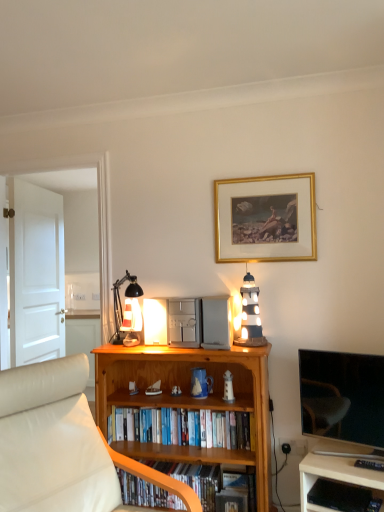
The image size is (384, 512). What do you see at coordinates (36, 274) in the screenshot?
I see `white painted wood door at left` at bounding box center [36, 274].

Consider the image. Measure the distance between wooden bookcase at center and camera.

wooden bookcase at center and camera are 6.71 feet apart.

What do you see at coordinates (342, 396) in the screenshot? The height and width of the screenshot is (512, 384). I see `flat screen tv at right` at bounding box center [342, 396].

What do you see at coordinates (250, 315) in the screenshot? I see `white striped wood lighthouse at upper right` at bounding box center [250, 315].

The height and width of the screenshot is (512, 384). In order to click on matte white glass table lamp at upper center in this screenshot , I will do pyautogui.click(x=120, y=301).

Considering the positions of point (72, 438) and point (12, 349), is point (72, 438) closer or farther from the camera than point (12, 349)?

Point (72, 438) appears to be closer to the viewer than point (12, 349).

From a real-world perspective, is white leather studio couch at lower left below white painted wood door at left?

Yes, from a real-world perspective, white leather studio couch at lower left is beneath white painted wood door at left.

Looking at this image, is white painted wood door at left at the back of white leather studio couch at lower left?

white leather studio couch at lower left is not turned away from white painted wood door at left.

You are a GUI agent. You are given a task and a screenshot of the screen. Output one action in this format:
    pyautogui.click(x=<x>, y=<y>)
    Task: Click on the door above the white leather studio couch at lower left (from a real-world perspective)
    The height and width of the screenshot is (512, 384).
    Given the screenshot: What is the action you would take?
    pyautogui.click(x=36, y=274)

In terms of size, does white painted wood door at left appear bigger or smaller than matte white glass table lamp at upper center?

Clearly, white painted wood door at left is larger in size than matte white glass table lamp at upper center.

Which is farther from the camera, (58, 269) or (120, 321)?

The point (58, 269) is farther.

Does white painted wood door at left appear on the left side of matte white glass table lamp at upper center?

Yes, white painted wood door at left is to the left of matte white glass table lamp at upper center.

Is there a large distance between white painted wood door at left and matte white glass table lamp at upper center?

That's right, there is a large distance between white painted wood door at left and matte white glass table lamp at upper center.

From the image's perspective, is flat screen tv at right on top of wooden bookcase at center?

Yes, from the image's perspective, flat screen tv at right is over wooden bookcase at center.

Considering the positions of objects flat screen tv at right and wooden bookcase at center in the image provided, who is in front, flat screen tv at right or wooden bookcase at center?

flat screen tv at right is more forward.

From a real-world perspective, which object stands above the other?

flat screen tv at right, from a real-world perspective.

Is flat screen tv at right oriented away from wooden bookcase at center?

No, wooden bookcase at center is not at the back of flat screen tv at right.

Is flat screen tv at right facing away from wooden desk at lower right?

No, flat screen tv at right is not facing the opposite direction of wooden desk at lower right.

Would you consider flat screen tv at right to be distant from wooden desk at lower right?

flat screen tv at right is near wooden desk at lower right, not far away.

Considering the relative sizes of flat screen tv at right and wooden desk at lower right in the image provided, is flat screen tv at right wider than wooden desk at lower right?

Incorrect, the width of flat screen tv at right does not surpass that of wooden desk at lower right.

Looking at this image, from a real-world perspective, who is located lower, flat screen tv at right or wooden desk at lower right?

wooden desk at lower right.

Is the position of wooden bookcase at center less distant than that of flat screen tv at right?

No, wooden bookcase at center is behind flat screen tv at right.

Which is correct: wooden bookcase at center is inside flat screen tv at right, or outside of it?

wooden bookcase at center is spatially situated outside flat screen tv at right.

Which of these two, wooden bookcase at center or flat screen tv at right, is bigger?

wooden bookcase at center is bigger.

Is wooden bookcase at center next to flat screen tv at right?

No, wooden bookcase at center is not beside flat screen tv at right.

In the image, is wooden shelf at lower center, marked as the first book in a bottom-to-top arrangement, positioned in front of or behind gold/gilded picture frame at upper center?

→ Clearly, wooden shelf at lower center, marked as the first book in a bottom-to-top arrangement, is in front of gold/gilded picture frame at upper center.

Is point (204, 506) closer or farther from the camera than point (295, 234)?

Point (204, 506) is positioned closer to the camera compared to point (295, 234).

Considering the sizes of objects wooden shelf at lower center, marked as the first book in a bottom-to-top arrangement, and gold/gilded picture frame at upper center in the image provided, who is wider, wooden shelf at lower center, marked as the first book in a bottom-to-top arrangement, or gold/gilded picture frame at upper center?

wooden shelf at lower center, marked as the first book in a bottom-to-top arrangement.

In the scene shown: Between flat screen tv at right and white striped wood lighthouse at upper right, which one has less height?

With less height is white striped wood lighthouse at upper right.

From a real-world perspective, is flat screen tv at right below white striped wood lighthouse at upper right?

Yes, from a real-world perspective, flat screen tv at right is beneath white striped wood lighthouse at upper right.

Could you tell me if flat screen tv at right is turned towards white striped wood lighthouse at upper right?

No, flat screen tv at right does not turn towards white striped wood lighthouse at upper right.

Which of these two, flat screen tv at right or white striped wood lighthouse at upper right, is wider?

white striped wood lighthouse at upper right is wider.

The width and height of the screenshot is (384, 512). Find the location of `studio couch below the white painted wood door at left (from a real-world perspective)`. studio couch below the white painted wood door at left (from a real-world perspective) is located at coordinates (62, 445).

Find the location of a particular element. The width and height of the screenshot is (384, 512). door behind the matte white glass table lamp at upper center is located at coordinates (36, 274).

Based on their spatial positions, is flat screen tv at right or wooden shelf at lower center, the 2th book in the top-to-bottom sequence, closer to wooden bookcase at center?

Based on the image, wooden shelf at lower center, the 2th book in the top-to-bottom sequence, appears to be nearer to wooden bookcase at center.

Based on their spatial positions, is wooden shelf at lower center, the 2th book in the top-to-bottom sequence, or wooden desk at lower right further from white leather studio couch at lower left?

The object further to white leather studio couch at lower left is wooden desk at lower right.

Estimate the real-world distances between objects in this image. Which object is further from wooden bookcase at center, hardcover books at center, positioned as the 1th book in top-to-bottom order, or gold/gilded picture frame at upper center?

gold/gilded picture frame at upper center lies further to wooden bookcase at center than the other object.

When comparing their distances from wooden desk at lower right, does white striped wood lighthouse at upper right or white painted wood door at left seem closer?

white striped wood lighthouse at upper right is closer to wooden desk at lower right.

Estimate the real-world distances between objects in this image. Which object is closer to flat screen tv at right, wooden bookcase at center or gold/gilded picture frame at upper center?

wooden bookcase at center is positioned closer to the anchor flat screen tv at right.

In the scene shown: Considering their positions, is white leather studio couch at lower left positioned closer to hardcover books at center, positioned as the 1th book in top-to-bottom order, than wooden bookcase at center?

Among the two, wooden bookcase at center is located nearer to hardcover books at center, positioned as the 1th book in top-to-bottom order.

Estimate the real-world distances between objects in this image. Which object is further from hardcover books at center, the second book from the bottom, white striped wood lighthouse at upper right or wooden shelf at lower center, marked as the first book in a bottom-to-top arrangement?

The object further to hardcover books at center, the second book from the bottom, is white striped wood lighthouse at upper right.

Estimate the real-world distances between objects in this image. Which object is closer to white striped wood lighthouse at upper right, matte white glass table lamp at upper center or wooden shelf at lower center, marked as the first book in a bottom-to-top arrangement?

Among the two, matte white glass table lamp at upper center is located nearer to white striped wood lighthouse at upper right.

At what (x,y) coordinates should I click in order to perform the action: click on lamp between white painted wood door at left and flat screen tv at right from left to right. Please return your answer as a coordinate pair (x, y). The image size is (384, 512). Looking at the image, I should click on point(250,315).

This screenshot has height=512, width=384. In order to click on table lamp between gold/gilded picture frame at upper center and hardcover books at center, the second book from the bottom, vertically in this screenshot , I will do `click(120, 301)`.

Image resolution: width=384 pixels, height=512 pixels. What are the coordinates of `lamp between gold/gilded picture frame at upper center and flat screen tv at right in the vertical direction` in the screenshot? It's located at (250, 315).

Locate an element on the screen. The width and height of the screenshot is (384, 512). table lamp between white painted wood door at left and hardcover books at center, the second book from the bottom, from left to right is located at coordinates point(120,301).